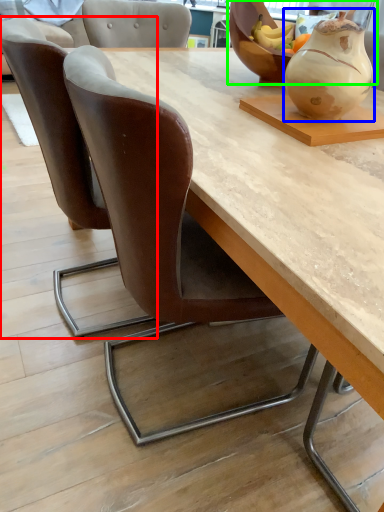
Question: Which object is positioned farthest from chair (highlighted by a red box)? Select from vase (highlighted by a blue box) and bowl (highlighted by a green box).

Choices:
 (A) vase
 (B) bowl

Answer: (B)